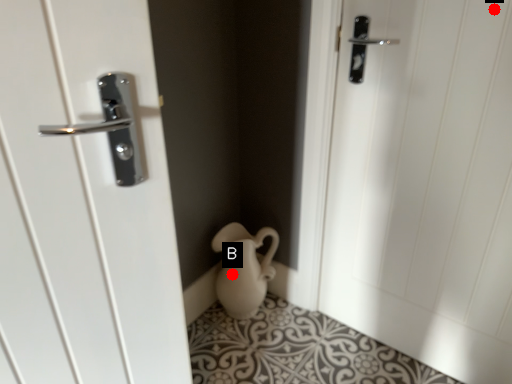
Question: Two points are circled on the image, labeled by A and B beside each circle. Which of the following is the closest to the observer?

Choices:
 (A) A is closer
 (B) B is closer

Answer: (A)